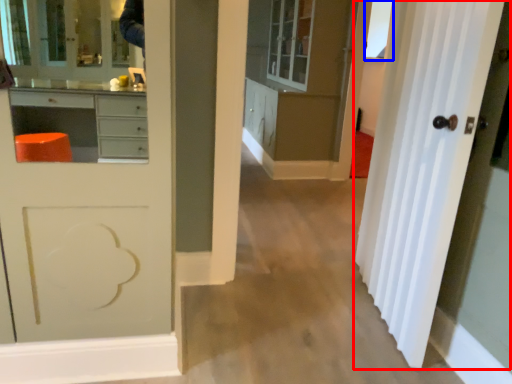
Question: Which object appears farthest to the camera in this image, door (highlighted by a red box) or window (highlighted by a blue box)?

Choices:
 (A) door
 (B) window

Answer: (B)